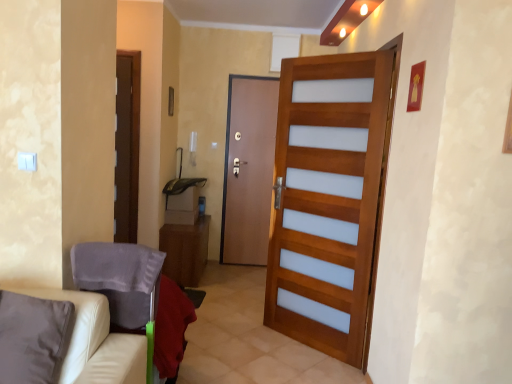
Find the location of a particular element. This screenshot has width=512, height=384. free point below wooden door at center, the second door from the back (from a real-world perspective) is located at coordinates (294, 352).